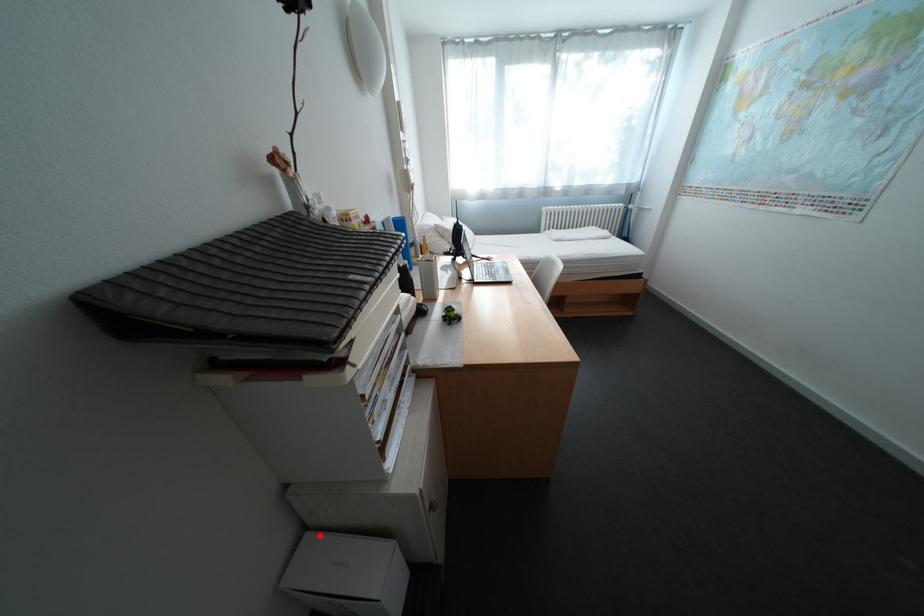
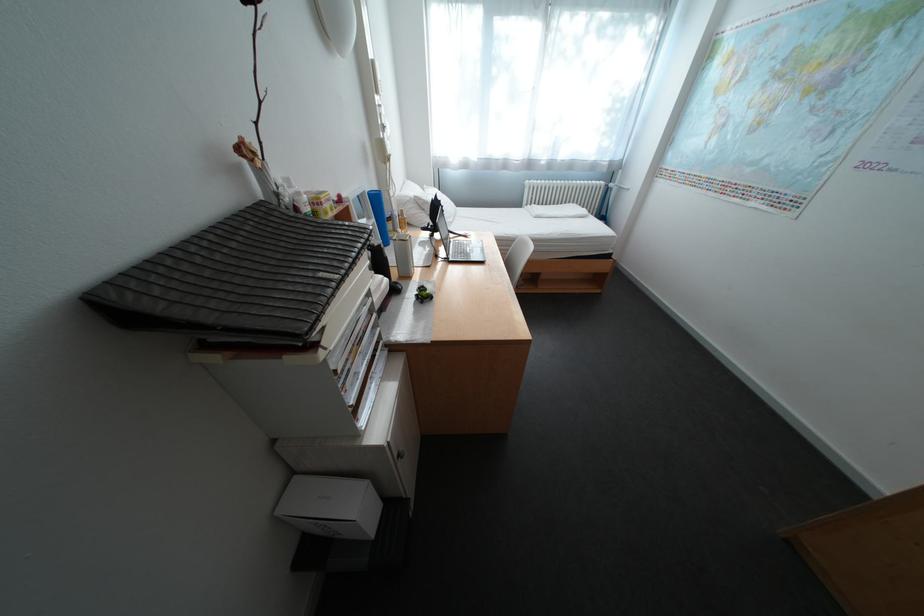
Find the pixel in the second image that matches the highlighted location in the first image.

(308, 479)